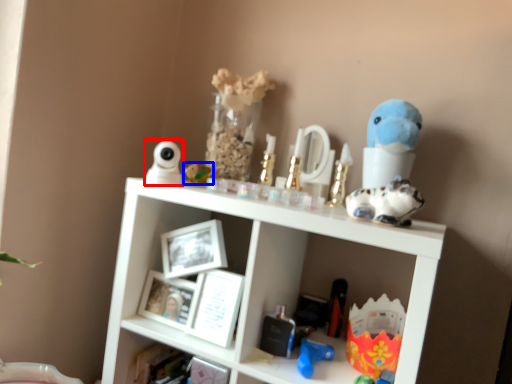
Question: Among these objects, which one is nearest to the camera, toy (highlighted by a red box) or toy (highlighted by a blue box)?

Choices:
 (A) toy
 (B) toy

Answer: (A)